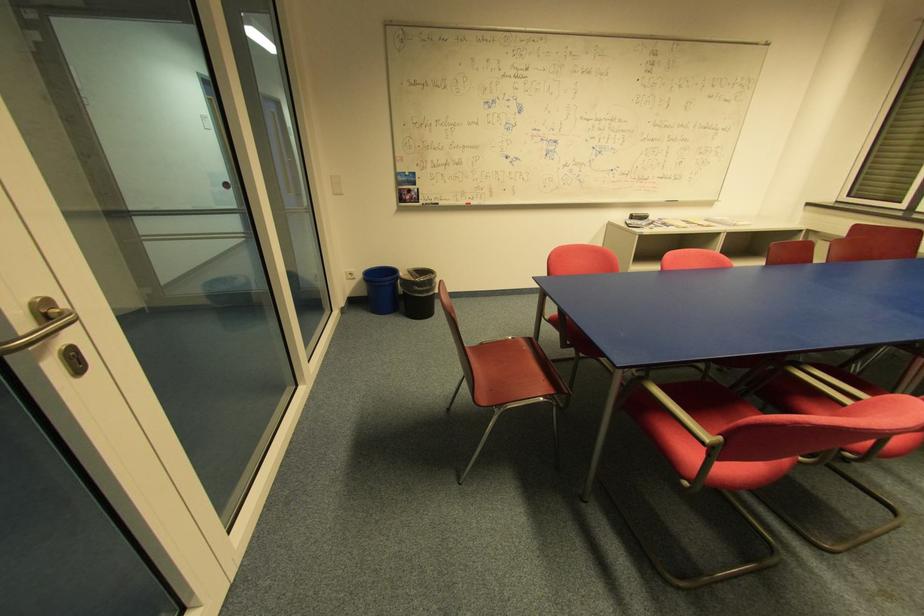
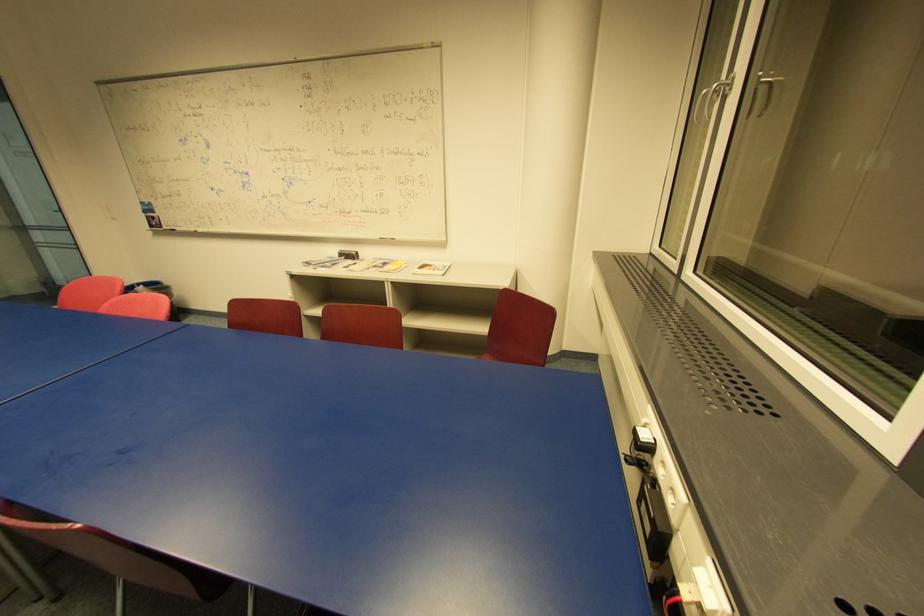
Question: The images are taken continuously from a first-person perspective. In which direction are you moving?

Choices:
 (A) Left
 (B) Right
 (C) Forward
 (D) Backward

Answer: (B)